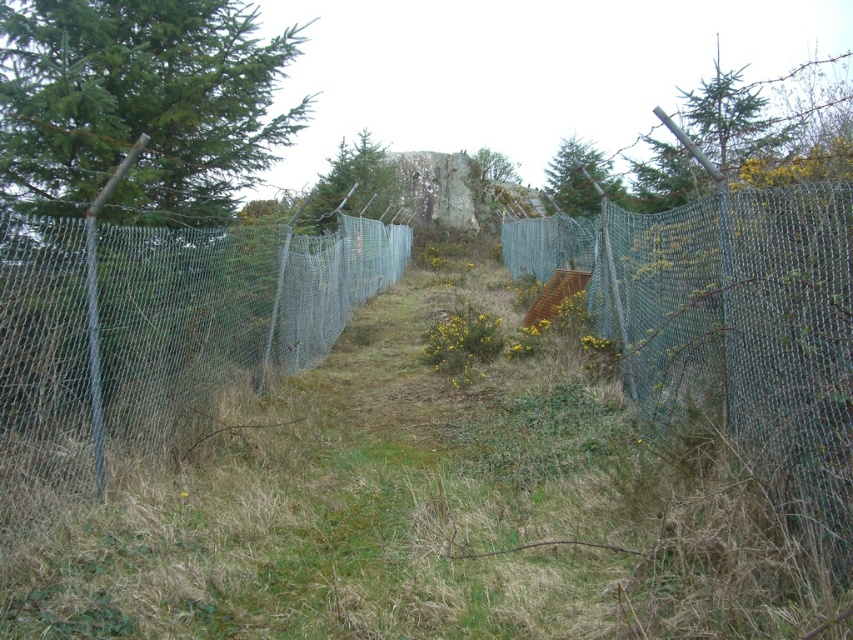
Question: Which is farther from the green leafy tree at left?

Choices:
 (A) green leafy tree at center
 (B) green leafy tree at upper center
 (C) green textured tree at upper center

Answer: (A)

Question: Is green leafy tree at upper center smaller than green leafy tree at center?

Choices:
 (A) no
 (B) yes

Answer: (A)

Question: Which of the following is the closest to the observer?

Choices:
 (A) (80, 230)
 (B) (376, 214)
 (C) (508, 164)

Answer: (A)

Question: Based on their relative distances, which object is farther from the green leafy tree at center?

Choices:
 (A) metal mesh fence at center
 (B) green chain-link fence at right
 (C) green leafy tree at upper center

Answer: (A)

Question: Does green chain-link fence at right appear over green leafy tree at left?

Choices:
 (A) yes
 (B) no

Answer: (B)

Question: Is green leafy tree at upper center thinner than green leafy tree at center?

Choices:
 (A) yes
 (B) no

Answer: (B)